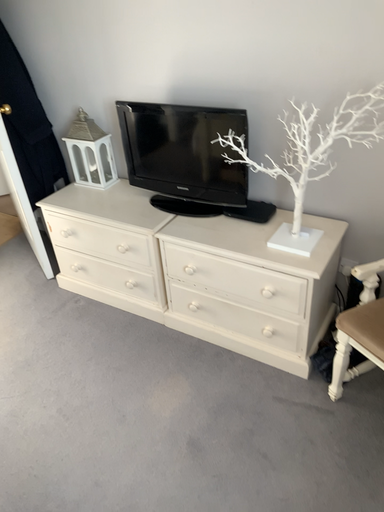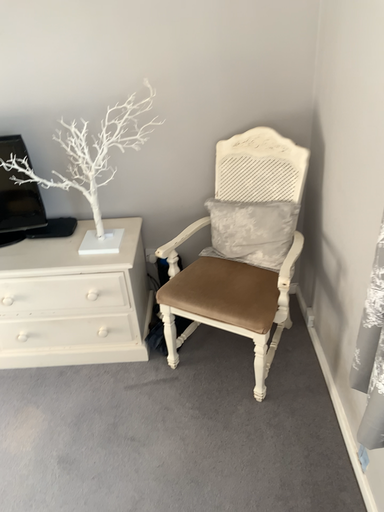
Question: How did the camera likely rotate when shooting the video?

Choices:
 (A) rotated left
 (B) rotated right

Answer: (B)